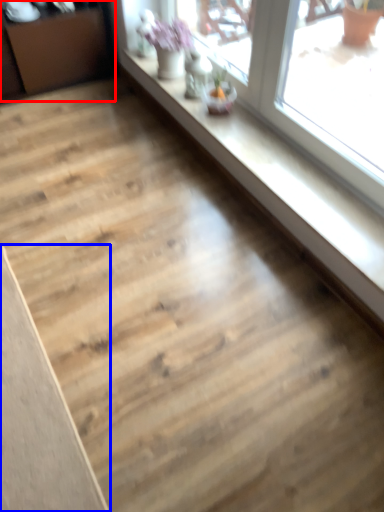
Question: Among these objects, which one is nearest to the camera, dresser (highlighted by a red box) or plank (highlighted by a blue box)?

Choices:
 (A) dresser
 (B) plank

Answer: (B)